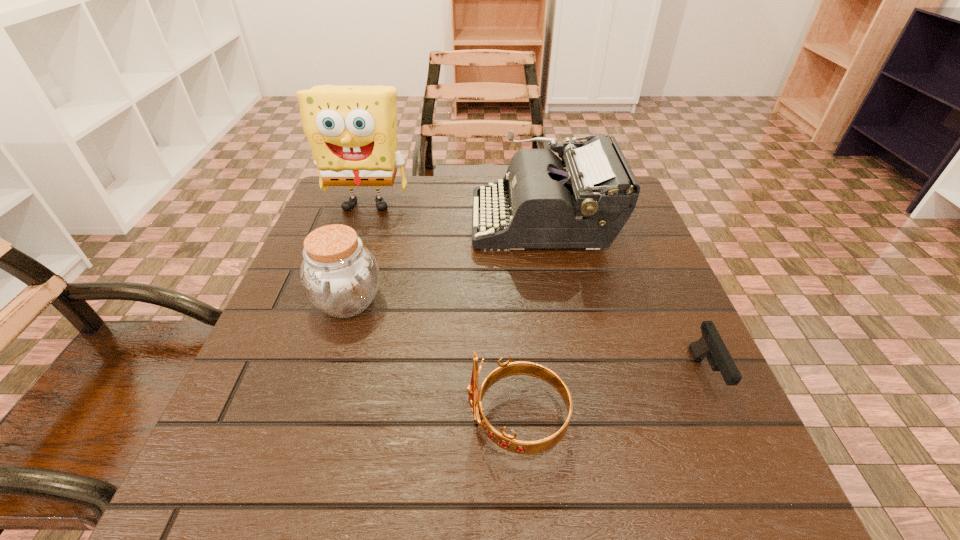
Image resolution: width=960 pixels, height=540 pixels. What are the coordinates of `vacant space situated on the front-facing side of the tiara` in the screenshot? It's located at (303, 420).

Find the location of `vacant point located 0.360m on the front-facing side of the tiara`. vacant point located 0.360m on the front-facing side of the tiara is located at coordinates (231, 420).

Where is `blank space located 0.060m on the front-facing side of the tiara`? The width and height of the screenshot is (960, 540). blank space located 0.060m on the front-facing side of the tiara is located at coordinates (428, 420).

The image size is (960, 540). Identify the location of free space located 0.050m on the right of the third farthest object. (410, 301).

Identify the location of free region located on the front-facing side of the pistol. This screenshot has width=960, height=540. (770, 519).

Find the location of a particular element. sponge located in the far edge section of the desktop is located at coordinates (352, 130).

Where is `typewriter positioned at the far edge`? Image resolution: width=960 pixels, height=540 pixels. typewriter positioned at the far edge is located at coordinates (584, 200).

I want to click on object at the near edge, so click(x=508, y=442).

You are a GUI agent. You are given a task and a screenshot of the screen. Output one action in this format:
    pyautogui.click(x=<x>, y=<y>)
    Task: Click on the sponge situated at the left edge
    The height and width of the screenshot is (540, 960).
    Given the screenshot: What is the action you would take?
    [352, 130]

Where is `jar at the left edge`? This screenshot has height=540, width=960. jar at the left edge is located at coordinates (339, 276).